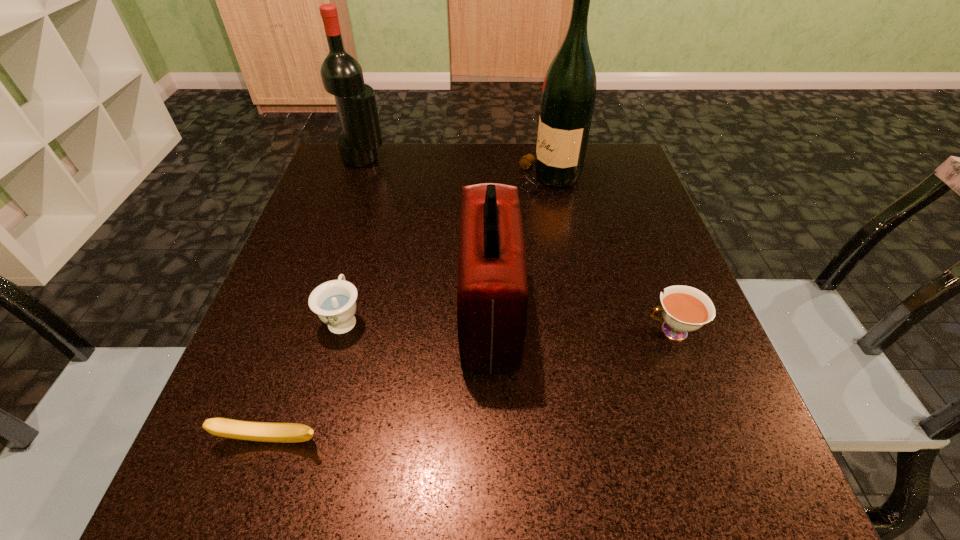
You are a GUI agent. You are given a task and a screenshot of the screen. Output one action in this format:
    pyautogui.click(x=<x>, y=<y>)
    Task: Click on the right wine bottle
    The height and width of the screenshot is (540, 960).
    Given the screenshot: What is the action you would take?
    pyautogui.click(x=568, y=97)

This screenshot has width=960, height=540. In order to click on the second tallest object in this screenshot , I will do `click(342, 76)`.

Locate an element on the screen. This screenshot has height=540, width=960. the shorter wine bottle is located at coordinates (342, 76).

I want to click on the first aid kit, so click(492, 293).

Where is `the fourth object from left to right`? Image resolution: width=960 pixels, height=540 pixels. the fourth object from left to right is located at coordinates (492, 293).

Where is `the left teacup`? the left teacup is located at coordinates (334, 302).

Find the location of a particular element. The height and width of the screenshot is (540, 960). the rightmost object is located at coordinates (684, 309).

What are the coordinates of `the shortest object` in the screenshot? It's located at (236, 429).

You are a GUI agent. You are given a task and a screenshot of the screen. Output one action in this format:
    pyautogui.click(x=<x>, y=<y>)
    Task: Click on the banana
    
    Given the screenshot: What is the action you would take?
    pyautogui.click(x=236, y=429)

This screenshot has width=960, height=540. Identify the location of vacant position located on the surface of the second object from right to left. (367, 178).